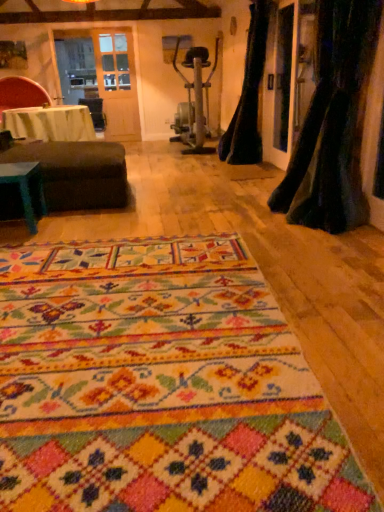
Question: Is black velvet curtain at right, which is counted as the first curtain, starting from the front, taller than multicolored woven rug at center?

Choices:
 (A) no
 (B) yes

Answer: (B)

Question: Considering the relative sizes of black velvet curtain at right, which is the second curtain from back to front, and multicolored woven rug at center in the image provided, is black velvet curtain at right, which is the second curtain from back to front, thinner than multicolored woven rug at center?

Choices:
 (A) no
 (B) yes

Answer: (B)

Question: Can you confirm if black velvet curtain at right, which is counted as the first curtain, starting from the front, is shorter than multicolored woven rug at center?

Choices:
 (A) no
 (B) yes

Answer: (A)

Question: Does black velvet curtain at right, which is counted as the first curtain, starting from the front, lie in front of multicolored woven rug at center?

Choices:
 (A) no
 (B) yes

Answer: (A)

Question: Would you say black velvet curtain at right, which is the second curtain from back to front, contains multicolored woven rug at center?

Choices:
 (A) yes
 (B) no

Answer: (B)

Question: From the image's perspective, is dark brown fabric ottoman at left above or below white cloth-covered table at left, acting as the 2th table starting from the front?

Choices:
 (A) below
 (B) above

Answer: (A)

Question: Considering their positions, is dark brown fabric ottoman at left located in front of or behind white cloth-covered table at left, the 2th table when ordered from bottom to top?

Choices:
 (A) front
 (B) behind

Answer: (A)

Question: Considering the positions of dark brown fabric ottoman at left and white cloth-covered table at left, acting as the 2th table starting from the front, in the image, is dark brown fabric ottoman at left wider or thinner than white cloth-covered table at left, acting as the 2th table starting from the front,?

Choices:
 (A) thin
 (B) wide

Answer: (B)

Question: Does point (117, 198) appear closer or farther from the camera than point (36, 126)?

Choices:
 (A) farther
 (B) closer

Answer: (B)

Question: From the image's perspective, is white cloth-covered table at left, which is the 1th table from top to bottom, positioned above or below velvet red chair at upper left?

Choices:
 (A) above
 (B) below

Answer: (B)

Question: Would you say white cloth-covered table at left, which is the 1th table from top to bottom, is inside or outside velvet red chair at upper left?

Choices:
 (A) outside
 (B) inside

Answer: (A)

Question: In terms of width, does white cloth-covered table at left, which ranks as the 1th table in back-to-front order, look wider or thinner when compared to velvet red chair at upper left?

Choices:
 (A) wide
 (B) thin

Answer: (A)

Question: Relative to velvet red chair at upper left, is white cloth-covered table at left, which ranks as the 1th table in back-to-front order, in front or behind?

Choices:
 (A) behind
 (B) front

Answer: (B)

Question: Is black velvet curtain at right, which is the second curtain from back to front, bigger or smaller than dark brown fabric ottoman at left?

Choices:
 (A) small
 (B) big

Answer: (A)

Question: In the image, is black velvet curtain at right, which is the second curtain from back to front, positioned in front of or behind dark brown fabric ottoman at left?

Choices:
 (A) front
 (B) behind

Answer: (A)